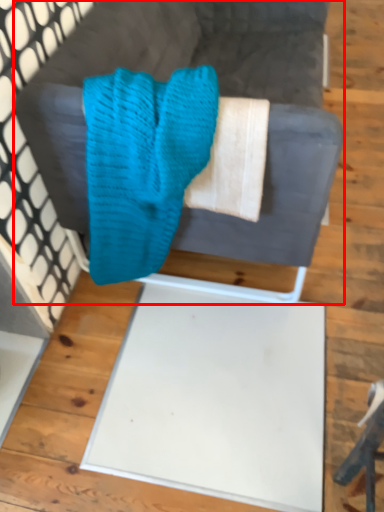
Question: Where is furniture (annotated by the red box) located in relation to scrub in the image?

Choices:
 (A) right
 (B) left

Answer: (A)